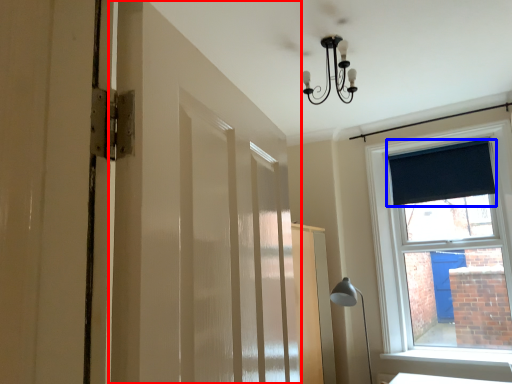
Question: Which object is further to the camera taking this photo, barn door (highlighted by a red box) or curtain (highlighted by a blue box)?

Choices:
 (A) barn door
 (B) curtain

Answer: (B)